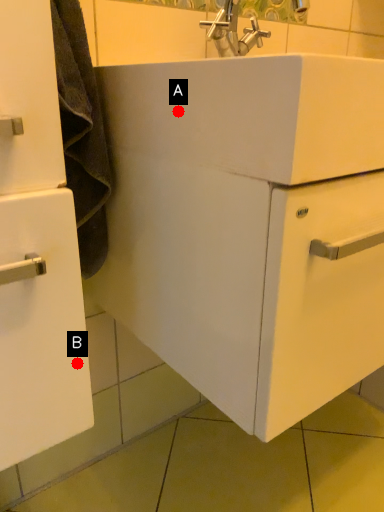
Question: Two points are circled on the image, labeled by A and B beside each circle. Which point appears farthest from the camera in this image?

Choices:
 (A) A is further
 (B) B is further

Answer: (A)